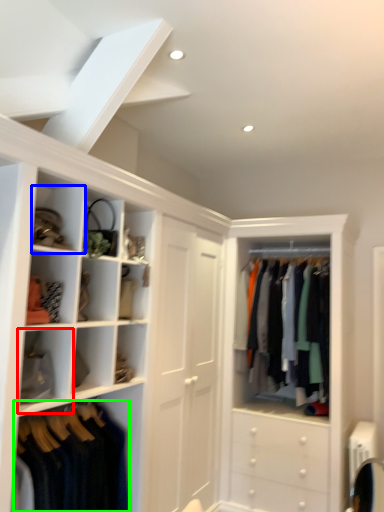
Question: Which object is positioned closest to cabinet (highlighted by a red box)? Select from cabinet (highlighted by a blue box) and clothing (highlighted by a green box).

Choices:
 (A) cabinet
 (B) clothing

Answer: (B)